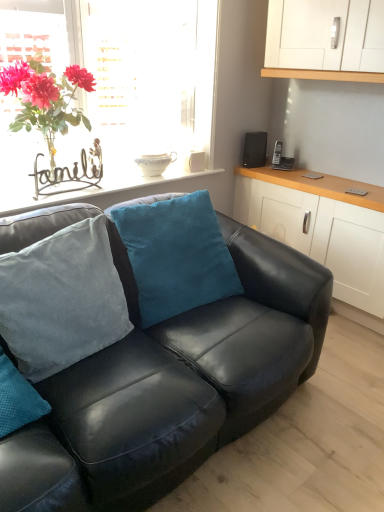
Question: From a real-world perspective, is matte metal sign at upper left on glass vase at upper left?

Choices:
 (A) yes
 (B) no

Answer: (B)

Question: Is matte metal sign at upper left positioned behind glass vase at upper left?

Choices:
 (A) no
 (B) yes

Answer: (B)

Question: Is matte metal sign at upper left to the right of glass vase at upper left from the viewer's perspective?

Choices:
 (A) yes
 (B) no

Answer: (B)

Question: Is glass vase at upper left at the back of matte metal sign at upper left?

Choices:
 (A) yes
 (B) no

Answer: (A)

Question: Is glass vase at upper left surrounded by matte metal sign at upper left?

Choices:
 (A) yes
 (B) no

Answer: (B)

Question: Can you confirm if matte metal sign at upper left is taller than glass vase at upper left?

Choices:
 (A) yes
 (B) no

Answer: (B)

Question: From the image's perspective, is teal velvety pillow at center, the first pillow in the right-to-left sequence, over black matte speaker at upper right?

Choices:
 (A) yes
 (B) no

Answer: (B)

Question: From a real-world perspective, is teal velvety pillow at center, the first pillow in the right-to-left sequence, beneath black matte speaker at upper right?

Choices:
 (A) yes
 (B) no

Answer: (A)

Question: Does teal velvety pillow at center, placed as the second pillow when sorted from left to right, have a lesser height compared to black matte speaker at upper right?

Choices:
 (A) yes
 (B) no

Answer: (B)

Question: Is teal velvety pillow at center, the first pillow in the right-to-left sequence, to the left of black matte speaker at upper right from the viewer's perspective?

Choices:
 (A) yes
 (B) no

Answer: (A)

Question: Is teal velvety pillow at center, placed as the second pillow when sorted from left to right, positioned in front of black matte speaker at upper right?

Choices:
 (A) no
 (B) yes

Answer: (B)

Question: Is teal velvety pillow at center, placed as the second pillow when sorted from left to right, aimed at black matte speaker at upper right?

Choices:
 (A) yes
 (B) no

Answer: (B)

Question: Considering the relative positions of glass vase at upper left and black matte speaker at upper right in the image provided, is glass vase at upper left to the right of black matte speaker at upper right from the viewer's perspective?

Choices:
 (A) no
 (B) yes

Answer: (A)